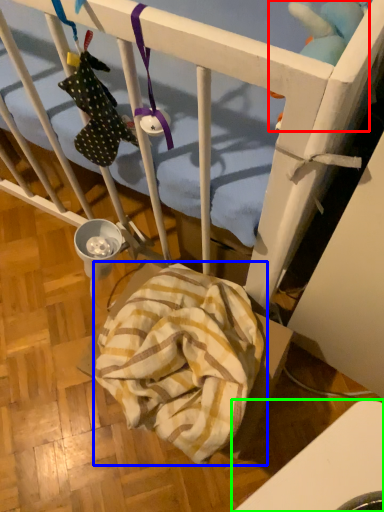
Question: Which is nearer to the toy (highlighted by a red box)? blanket (highlighted by a blue box) or furniture (highlighted by a green box).

Choices:
 (A) blanket
 (B) furniture

Answer: (A)